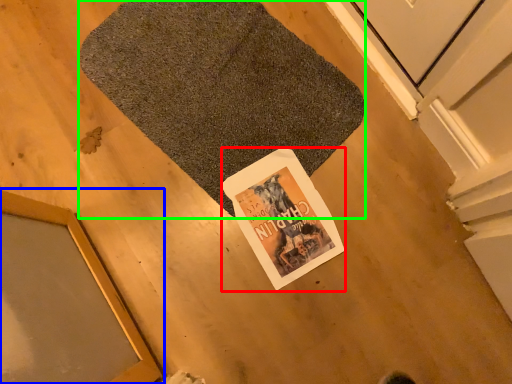
Question: Which object is the closest to the magazine (highlighted by a red box)? Choose among these: window (highlighted by a blue box) or bath mat (highlighted by a green box).

Choices:
 (A) window
 (B) bath mat

Answer: (B)